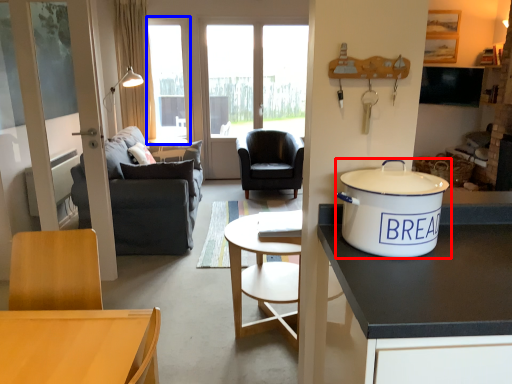
Question: Which point is further to the camera, tableware (highlighted by a red box) or window (highlighted by a blue box)?

Choices:
 (A) tableware
 (B) window

Answer: (B)